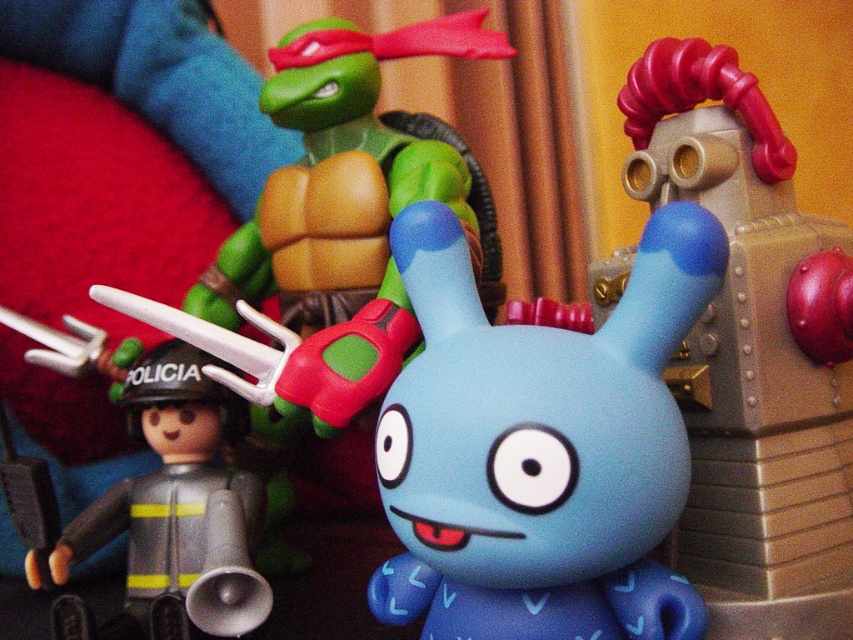
Does blue rubber toy at center appear under black matte police officer at left?

Actually, blue rubber toy at center is above black matte police officer at left.

Find the location of a particular element. This screenshot has height=640, width=853. blue rubber toy at center is located at coordinates coord(753,353).

Is blue matte toy at center in front of blue rubber toy at center?

Yes, it is.

Does point (440, 288) come in front of point (798, 592)?

Yes, point (440, 288) is in front of point (798, 592).

Locate an element on the screen. The width and height of the screenshot is (853, 640). blue matte toy at center is located at coordinates (538, 449).

Is blue matte toy at center positioned before black matte police officer at left?

That is True.

Is point (672, 465) closer to viewer compared to point (196, 528)?

Yes, it is in front of point (196, 528).

Find the location of a particular element. blue matte toy at center is located at coordinates (538, 449).